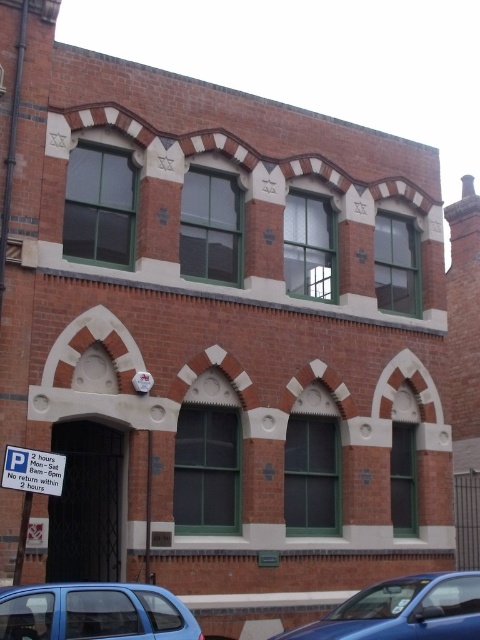
Is blue metallic hatchback at lower left shorter than blue glossy car at lower right?

Yes, blue metallic hatchback at lower left is shorter than blue glossy car at lower right.

In order to click on blue metallic hatchback at lower left in this screenshot , I will do `click(94, 612)`.

Does blue glossy car at lower right appear under metallic rectangular sign at lower left?

Yes.

Is blue glossy car at lower right to the right of metallic rectangular sign at lower left from the viewer's perspective?

Correct, you'll find blue glossy car at lower right to the right of metallic rectangular sign at lower left.

Between point (388, 628) and point (25, 483), which one is positioned in front?

Point (388, 628) is in front.

Where is `blue glossy car at lower right`? The height and width of the screenshot is (640, 480). blue glossy car at lower right is located at coordinates (404, 611).

Does blue metallic hatchback at lower left have a lesser width compared to metallic rectangular sign at lower left?

In fact, blue metallic hatchback at lower left might be wider than metallic rectangular sign at lower left.

Is the position of blue metallic hatchback at lower left more distant than that of metallic rectangular sign at lower left?

No, blue metallic hatchback at lower left is closer to the viewer.

Where is `blue metallic hatchback at lower left`? The height and width of the screenshot is (640, 480). blue metallic hatchback at lower left is located at coordinates (94, 612).

Identify the location of blue metallic hatchback at lower left. (94, 612).